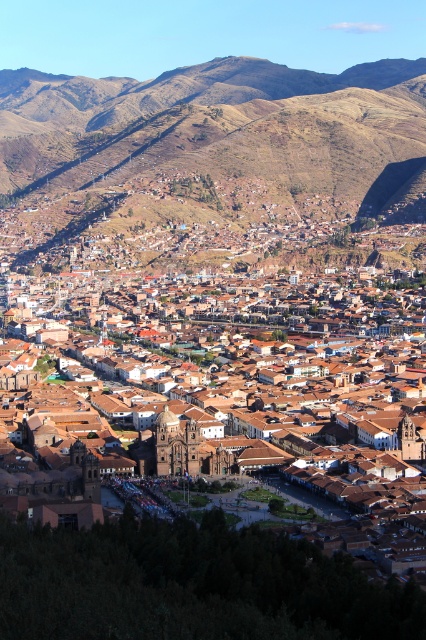
You are a hiker who wants to take a photo of the brown clay buildings at center from the brown rocky mountain at upper center. Is the mountain positioned in a way that allows you to capture the buildings in your shot?

The brown rocky mountain at upper center is to the right of brown clay buildings at center, so if you are standing on the mountain, you can see the buildings to your left. This position allows you to capture the buildings in your photo.

You are a hiker who wants to take a photo of the brown clay buildings at center without the brown rocky mountain at upper center blocking the view. What should you do?

The brown rocky mountain at upper center is positioned over the brown clay buildings at center, so to avoid the mountain blocking the view, you should move to a lower elevation or position yourself below the mountain where the buildings are more visible.